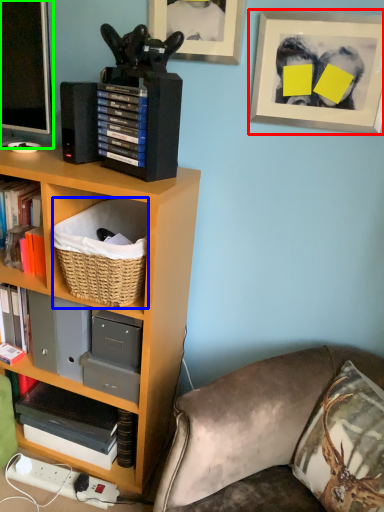
Question: Which object is the farthest from picture frame (highlighted by a red box)? Choose among these: basket (highlighted by a blue box) or television (highlighted by a green box).

Choices:
 (A) basket
 (B) television

Answer: (B)